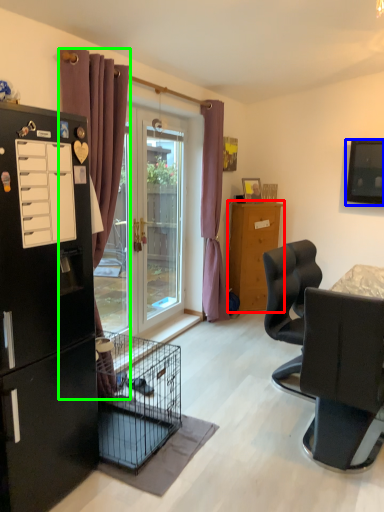
Question: Based on their relative distances, which object is nearer to refrigerator (highlighted by a red box)? Choose from television (highlighted by a blue box) and curtain (highlighted by a green box).

Choices:
 (A) television
 (B) curtain

Answer: (A)